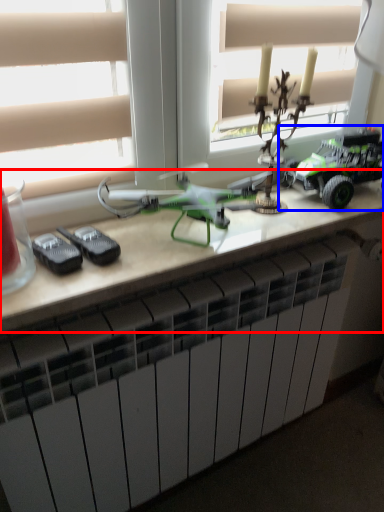
Question: Among these objects, which one is nearest to the camera, table (highlighted by a red box) or toy (highlighted by a blue box)?

Choices:
 (A) table
 (B) toy

Answer: (A)